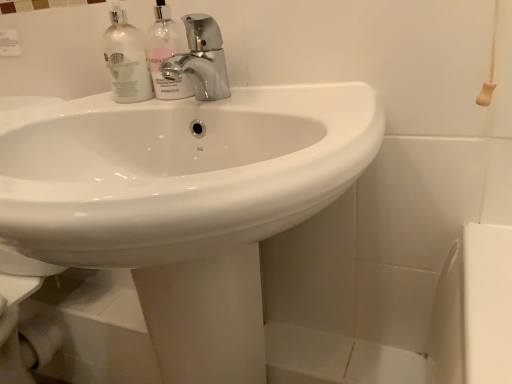
Question: Is white glossy sink at center inside or outside of clear glass bottle at upper center, which is counted as the first cleaning product, starting from the right?

Choices:
 (A) outside
 (B) inside

Answer: (A)

Question: In the image, is white glossy sink at center positioned in front of or behind clear glass bottle at upper center, which is counted as the first cleaning product, starting from the right?

Choices:
 (A) front
 (B) behind

Answer: (A)

Question: Based on their relative distances, which object is nearer to the clear glass bottle at upper center, which is counted as the first cleaning product, starting from the right?

Choices:
 (A) white glossy sink at center
 (B) translucent glass bottles at upper left, which is the second cleaning product from right to left
 (C) chrome metallic faucet at center

Answer: (B)

Question: Which is farther from the white glossy sink at center?

Choices:
 (A) clear glass bottle at upper center, which is counted as the first cleaning product, starting from the right
 (B) chrome metallic faucet at center
 (C) translucent glass bottles at upper left, which is counted as the 1th cleaning product, starting from the left

Answer: (C)